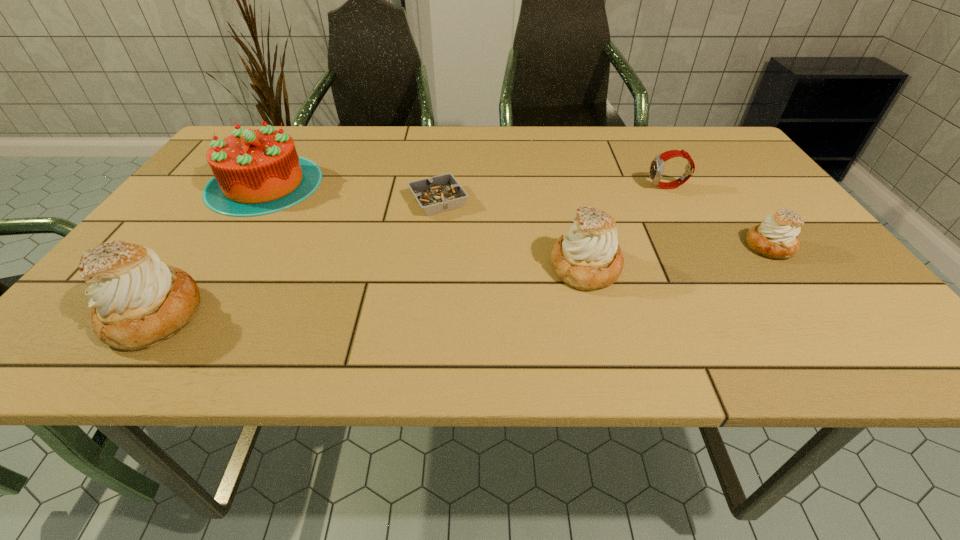
In order to click on vacant area situated 0.260m on the right of the second tallest pastry in this screenshot , I will do tap(748, 267).

Identify the location of vacant region located on the back of the rightmost object. (724, 184).

Locate an element on the screen. The width and height of the screenshot is (960, 540). free point located on the face of the watch is located at coordinates (629, 187).

I want to click on vacant space located 0.090m on the face of the watch, so click(613, 187).

At what (x,y) coordinates should I click in order to perform the action: click on vacant region located on the face of the watch. Please return your answer as a coordinate pair (x, y). This screenshot has height=540, width=960. Looking at the image, I should click on (562, 187).

Where is `blank space located on the right of the cake`? blank space located on the right of the cake is located at coordinates (352, 184).

At what (x,y) coordinates should I click in order to perform the action: click on blank area located on the front of the ashtray. Please return your answer as a coordinate pair (x, y). The image size is (960, 540). Looking at the image, I should click on (431, 264).

This screenshot has height=540, width=960. I want to click on object present at the far edge, so click(x=256, y=172).

Locate an element on the screen. This screenshot has width=960, height=540. pastry that is positioned at the left edge is located at coordinates (137, 301).

I want to click on cake at the left edge, so click(256, 172).